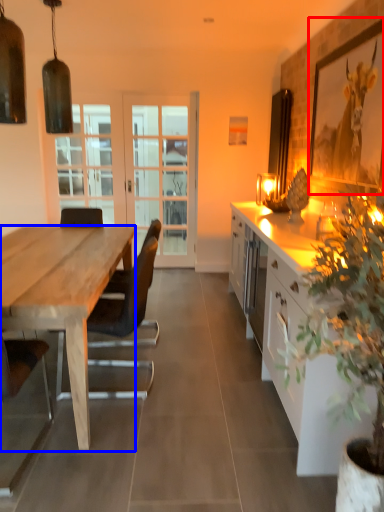
Question: Among these objects, which one is farthest to the camera, picture frame (highlighted by a red box) or desk (highlighted by a blue box)?

Choices:
 (A) picture frame
 (B) desk

Answer: (A)